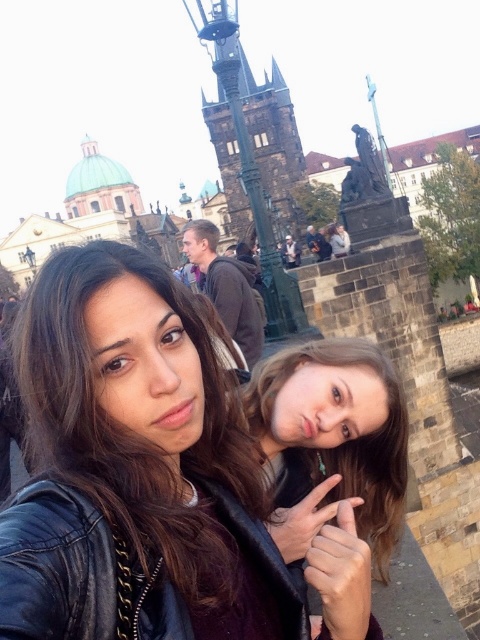
Question: Can you confirm if matte black leather jacket at center is thinner than brown leather jacket at center?

Choices:
 (A) yes
 (B) no

Answer: (B)

Question: Does brown hair at center have a smaller size compared to brown leather jacket at center?

Choices:
 (A) no
 (B) yes

Answer: (B)

Question: Can you confirm if brown hair at center is positioned to the left of dark brown stone tower at center?

Choices:
 (A) no
 (B) yes

Answer: (A)

Question: Estimate the real-world distances between objects in this image. Which object is closer to the dark brown stone tower at center?

Choices:
 (A) brown leather jacket at center
 (B) brown hair at center

Answer: (A)

Question: Which of the following is the closest to the observer?

Choices:
 (A) (286, 492)
 (B) (178, 337)

Answer: (B)

Question: Which point is farther from the camera taking this photo?

Choices:
 (A) (264, 228)
 (B) (324, 387)
 (C) (243, 332)
 (D) (257, 516)

Answer: (A)